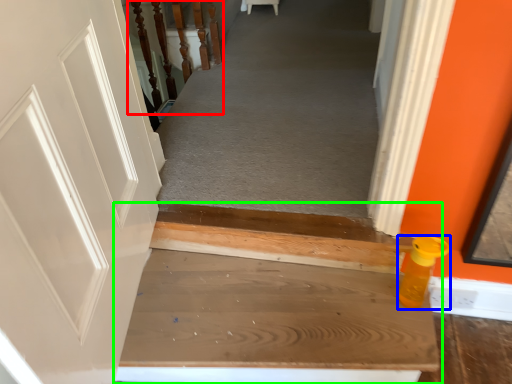
Question: Based on their relative distances, which object is nearer to rail (highlighted by a red box)? Choose from bottle (highlighted by a blue box) and stairs (highlighted by a green box).

Choices:
 (A) bottle
 (B) stairs

Answer: (B)